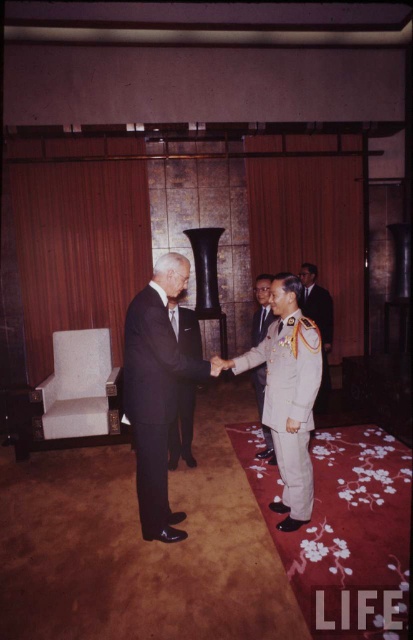
Who is higher up, black suit at center or silver metallic uniform at center?

Positioned higher is silver metallic uniform at center.

Can you confirm if black suit at center is taller than silver metallic uniform at center?

Correct, black suit at center is much taller as silver metallic uniform at center.

Which is behind, point (142, 376) or point (327, 376)?

The point (327, 376) is more distant.

The height and width of the screenshot is (640, 413). In order to click on black suit at center in this screenshot , I will do `click(156, 390)`.

Does khaki fabric uniform at center appear under light gray uniform at center?

Yes.

Is point (299, 397) behind point (256, 403)?

That is False.

Locate an element on the screen. This screenshot has width=413, height=640. khaki fabric uniform at center is located at coordinates (289, 401).

Is silver metallic uniform at center above light gray uniform at center?

Indeed, silver metallic uniform at center is positioned over light gray uniform at center.

Locate an element on the screen. The width and height of the screenshot is (413, 640). silver metallic uniform at center is located at coordinates (318, 323).

Identify the location of silver metallic uniform at center. (318, 323).